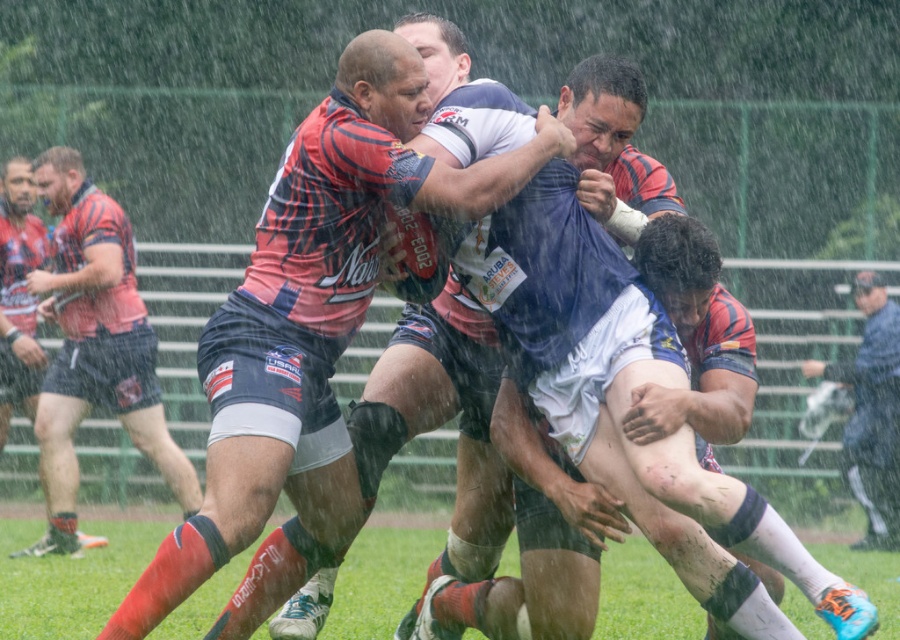
Question: Is matte red and blue rugby jersey at center above matte red shirt at left?

Choices:
 (A) yes
 (B) no

Answer: (A)

Question: Which point is farther to the camera?

Choices:
 (A) matte red and blue rugby jersey at center
 (B) blue fabric umbrella at right

Answer: (B)

Question: Which object is farther from the camera taking this photo?

Choices:
 (A) matte red shirt at left
 (B) blue fabric umbrella at right
 (C) matte red and blue rugby jersey at center

Answer: (B)

Question: Can you confirm if matte red shirt at left is positioned above blue fabric umbrella at right?

Choices:
 (A) yes
 (B) no

Answer: (A)

Question: Estimate the real-world distances between objects in this image. Which object is farther from the blue fabric umbrella at right?

Choices:
 (A) matte red shirt at left
 (B) matte red and blue rugby jersey at center

Answer: (B)

Question: Is matte red and blue rugby jersey at center below blue fabric umbrella at right?

Choices:
 (A) yes
 (B) no

Answer: (B)